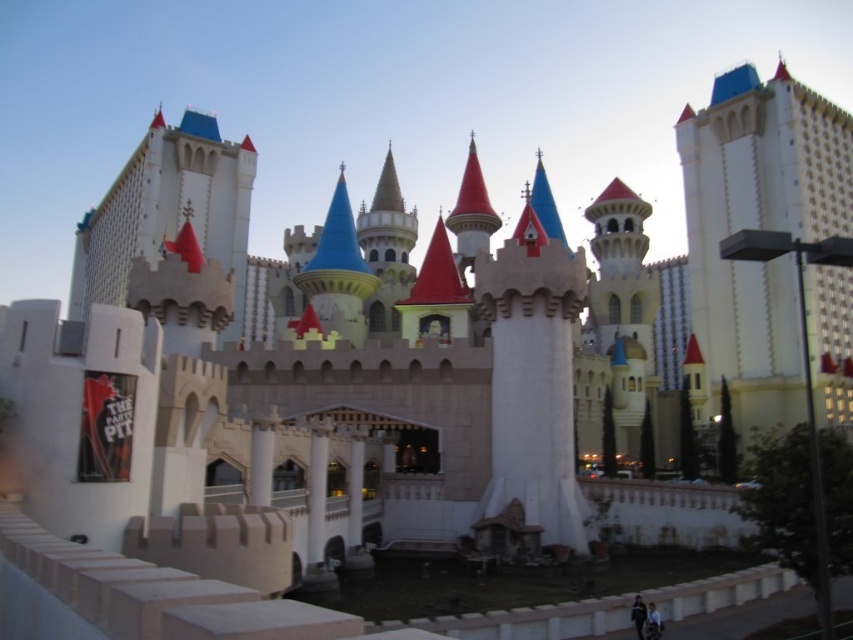
Which is more to the left, white stone castle at right or white stone castle at upper left?

white stone castle at upper left is more to the left.

Measure the distance between point (723, 304) and camera.

368.72 feet

This screenshot has width=853, height=640. Find the location of `white stone castle at right`. white stone castle at right is located at coordinates (759, 228).

Where is `white stone castle at right`? The height and width of the screenshot is (640, 853). white stone castle at right is located at coordinates (759, 228).